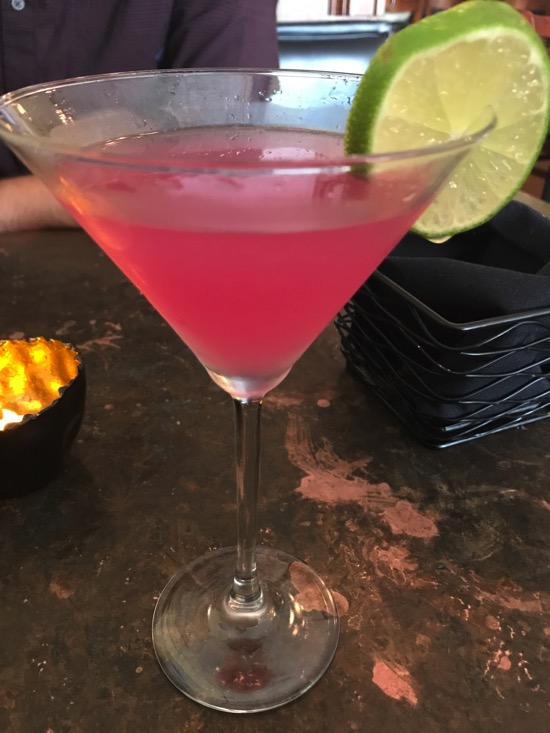
This screenshot has width=550, height=733. Find the location of `glass stem`. glass stem is located at coordinates (249, 515).